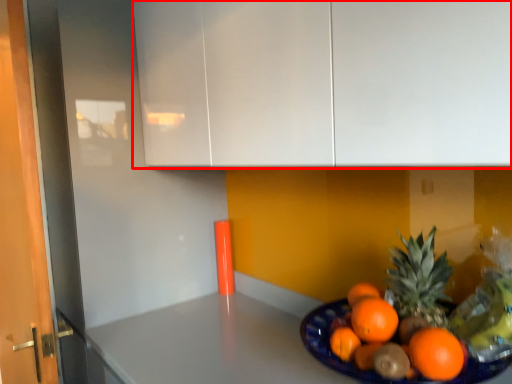
Question: From the image's perspective, where is cabinetry (annotated by the red box) located in relation to counter top in the image?

Choices:
 (A) above
 (B) below

Answer: (A)